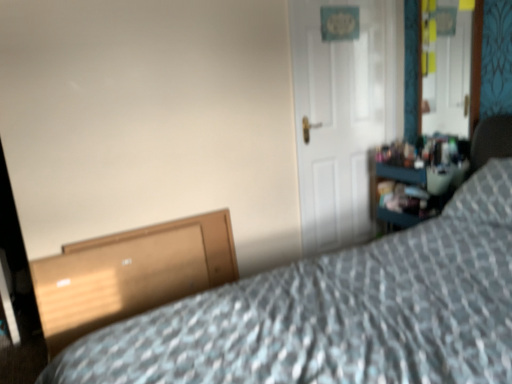
Question: From the image's perspective, is wooden file cabinet at lower left located beneath patterned fabric bed at lower right?

Choices:
 (A) yes
 (B) no

Answer: (A)

Question: Considering the relative sizes of wooden file cabinet at lower left and patterned fabric bed at lower right in the image provided, is wooden file cabinet at lower left taller than patterned fabric bed at lower right?

Choices:
 (A) yes
 (B) no

Answer: (B)

Question: Is wooden file cabinet at lower left aimed at patterned fabric bed at lower right?

Choices:
 (A) yes
 (B) no

Answer: (A)

Question: Can you confirm if wooden file cabinet at lower left is positioned to the left of patterned fabric bed at lower right?

Choices:
 (A) no
 (B) yes

Answer: (B)

Question: Is wooden file cabinet at lower left next to patterned fabric bed at lower right?

Choices:
 (A) yes
 (B) no

Answer: (B)

Question: Is wooden file cabinet at lower left not near patterned fabric bed at lower right?

Choices:
 (A) yes
 (B) no

Answer: (B)

Question: Are patterned fabric bed at lower right and wooden file cabinet at lower left far apart?

Choices:
 (A) yes
 (B) no

Answer: (B)

Question: Does patterned fabric bed at lower right touch wooden file cabinet at lower left?

Choices:
 (A) yes
 (B) no

Answer: (B)

Question: From a real-world perspective, is patterned fabric bed at lower right under wooden file cabinet at lower left?

Choices:
 (A) yes
 (B) no

Answer: (B)

Question: Can you confirm if patterned fabric bed at lower right is bigger than wooden file cabinet at lower left?

Choices:
 (A) no
 (B) yes

Answer: (B)

Question: Is patterned fabric bed at lower right outside of wooden file cabinet at lower left?

Choices:
 (A) yes
 (B) no

Answer: (A)

Question: Can you confirm if patterned fabric bed at lower right is smaller than wooden file cabinet at lower left?

Choices:
 (A) yes
 (B) no

Answer: (B)

Question: Does wooden file cabinet at lower left appear on the left side of white matte door at center?

Choices:
 (A) no
 (B) yes

Answer: (B)